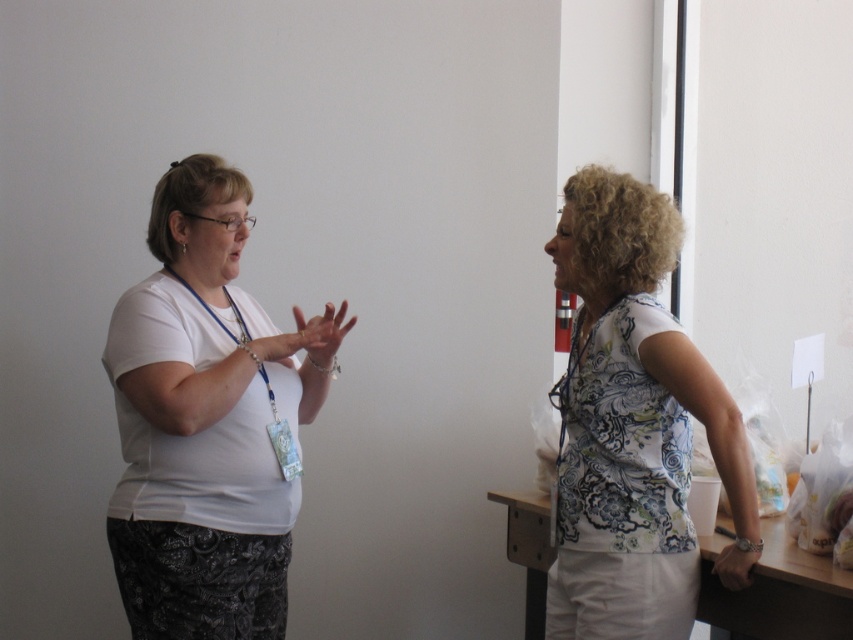
Question: Among these points, which one is farthest from the camera?

Choices:
 (A) (167, 520)
 (B) (633, 576)

Answer: (A)

Question: Considering the relative positions of white matte shirt at center and white printed blouse at right in the image provided, where is white matte shirt at center located with respect to white printed blouse at right?

Choices:
 (A) above
 (B) below

Answer: (A)

Question: Observing the image, what is the correct spatial positioning of white matte shirt at center in reference to white printed blouse at right?

Choices:
 (A) right
 (B) left

Answer: (B)

Question: Which of the following is the farthest from the observer?

Choices:
 (A) (631, 609)
 (B) (207, 413)

Answer: (B)

Question: Does white matte shirt at center come behind white printed blouse at right?

Choices:
 (A) no
 (B) yes

Answer: (B)